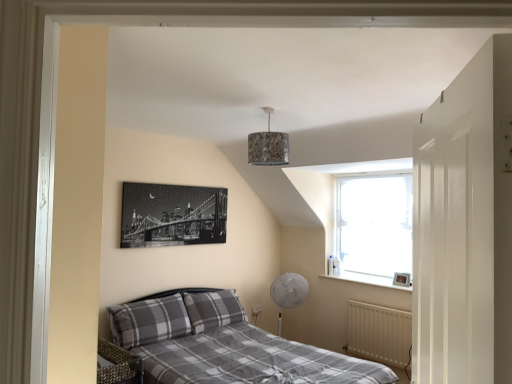
Question: Would you say camouflage fabric lampshade at center is a long distance from white matte radiator at lower right?

Choices:
 (A) no
 (B) yes

Answer: (B)

Question: Is camouflage fabric lampshade at center positioned in front of white matte radiator at lower right?

Choices:
 (A) yes
 (B) no

Answer: (A)

Question: Considering the relative positions of camouflage fabric lampshade at center and white matte radiator at lower right in the image provided, is camouflage fabric lampshade at center to the right of white matte radiator at lower right from the viewer's perspective?

Choices:
 (A) yes
 (B) no

Answer: (B)

Question: From a real-world perspective, is camouflage fabric lampshade at center physically above white matte radiator at lower right?

Choices:
 (A) no
 (B) yes

Answer: (B)

Question: Considering the relative positions of camouflage fabric lampshade at center and white matte radiator at lower right in the image provided, is camouflage fabric lampshade at center to the left of white matte radiator at lower right from the viewer's perspective?

Choices:
 (A) no
 (B) yes

Answer: (B)

Question: Considering their positions, is white glossy door at right located in front of or behind camouflage fabric lampshade at center?

Choices:
 (A) front
 (B) behind

Answer: (A)

Question: In terms of height, does white glossy door at right look taller or shorter compared to camouflage fabric lampshade at center?

Choices:
 (A) tall
 (B) short

Answer: (A)

Question: Considering the positions of point (476, 344) and point (256, 139), is point (476, 344) closer or farther from the camera than point (256, 139)?

Choices:
 (A) closer
 (B) farther

Answer: (A)

Question: From a real-world perspective, is white glossy door at right positioned above or below camouflage fabric lampshade at center?

Choices:
 (A) above
 (B) below

Answer: (B)

Question: Considering the positions of point (256, 150) and point (378, 190), is point (256, 150) closer or farther from the camera than point (378, 190)?

Choices:
 (A) farther
 (B) closer

Answer: (B)

Question: Is camouflage fabric lampshade at center in front of or behind white textured window at upper right in the image?

Choices:
 (A) behind
 (B) front

Answer: (B)

Question: From a real-world perspective, relative to white textured window at upper right, is camouflage fabric lampshade at center vertically above or below?

Choices:
 (A) below
 (B) above

Answer: (B)

Question: Considering the positions of camouflage fabric lampshade at center and white textured window at upper right in the image, is camouflage fabric lampshade at center bigger or smaller than white textured window at upper right?

Choices:
 (A) small
 (B) big

Answer: (A)

Question: Would you say white textured window at upper right is inside or outside gray plaid pillow at lower left, placed as the 2th pillow when sorted from right to left?

Choices:
 (A) inside
 (B) outside

Answer: (B)

Question: In the image, is white textured window at upper right on the left side or the right side of gray plaid pillow at lower left, the 1th pillow in the left-to-right sequence?

Choices:
 (A) right
 (B) left

Answer: (A)